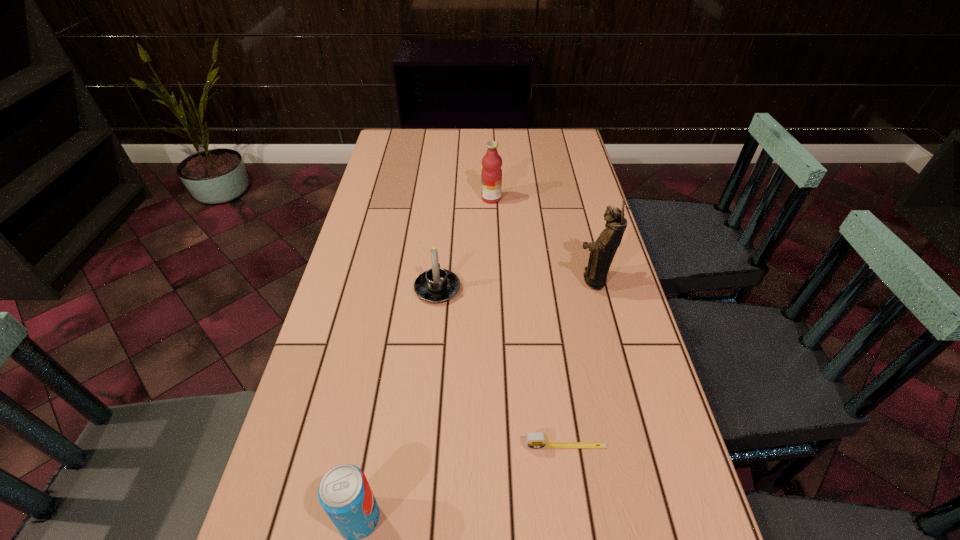
You are a GUI agent. You are given a task and a screenshot of the screen. Output one action in this format:
    pyautogui.click(x=<x>, y=<y>)
    Task: Click on the vacant space at the left edge of the desktop
    
    Given the screenshot: What is the action you would take?
    pyautogui.click(x=392, y=293)

This screenshot has height=540, width=960. Identify the location of vacant space at the right edge of the desktop. (605, 357).

In the image, there is a desktop. Where is `free space at the far right corner`? This screenshot has width=960, height=540. free space at the far right corner is located at coordinates click(x=540, y=133).

Where is `vacant space that is in between the tape measure and the figurine`? vacant space that is in between the tape measure and the figurine is located at coordinates (579, 363).

You are a GUI agent. You are given a task and a screenshot of the screen. Output one action in this format:
    pyautogui.click(x=<x>, y=<y>)
    Task: Click on the vacant region between the tape measure and the figurine
    The height and width of the screenshot is (540, 960).
    Given the screenshot: What is the action you would take?
    pyautogui.click(x=579, y=363)

Identify the location of vacant space that's between the shortest object and the second object from left to right. (501, 367).

Image resolution: width=960 pixels, height=540 pixels. What are the coordinates of `vacant area that lies between the farthest object and the candle holder` in the screenshot? It's located at (465, 244).

What are the coordinates of `vacant point located between the second object from right to left and the candle holder` in the screenshot? It's located at (501, 367).

Locate an element on the screen. Image resolution: width=960 pixels, height=540 pixels. free spot between the rightmost object and the second object from right to left is located at coordinates (579, 363).

Identify the location of vacant space in between the figurine and the second object from left to right. The image size is (960, 540). pos(515,284).